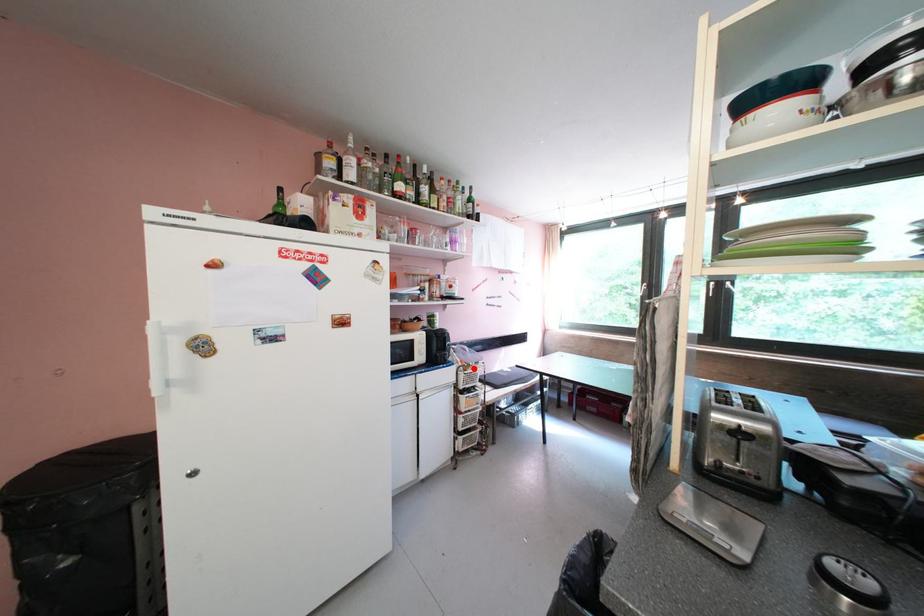
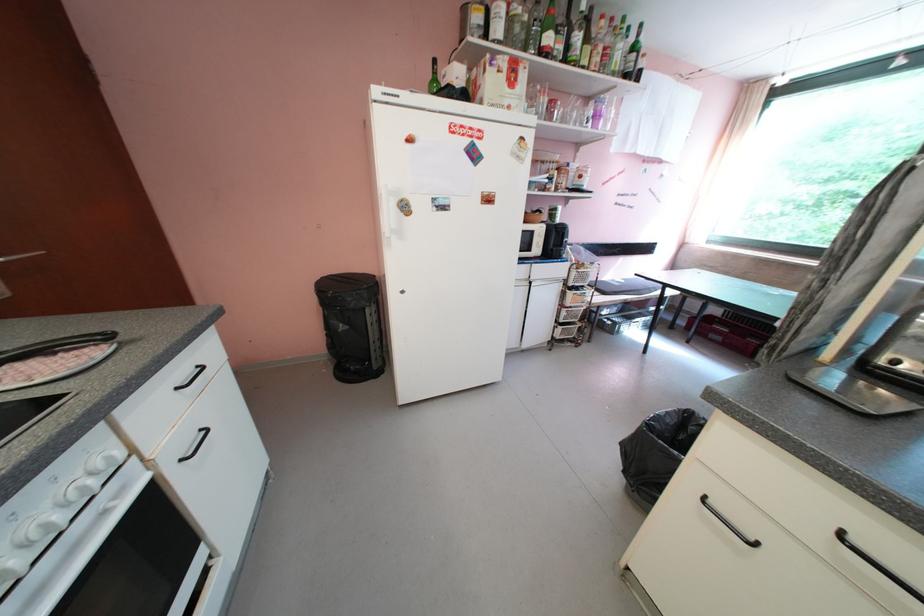
Locate, in the second image, the point that corresponds to the highlighted location in the first image.

(588, 268)